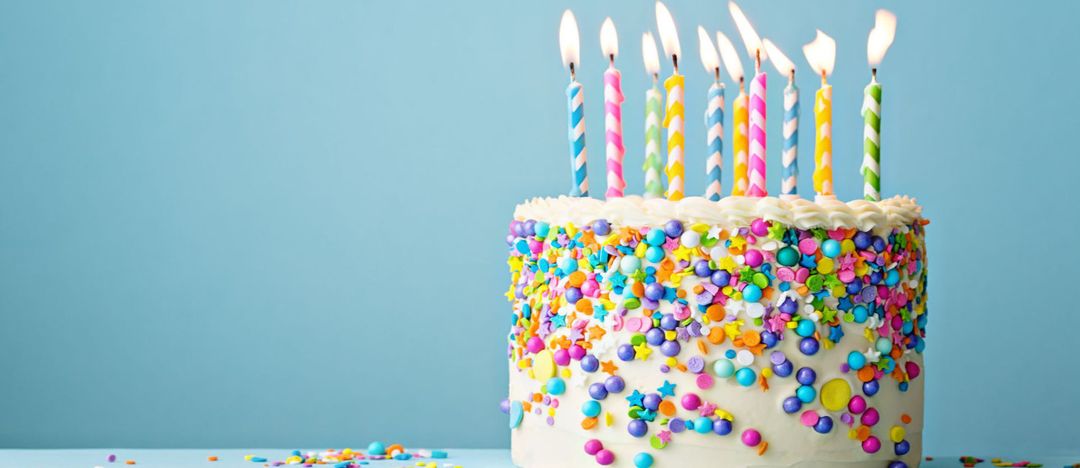
Locate an element on the screen. This screenshot has height=468, width=1080. candle is located at coordinates (580, 160), (615, 146), (653, 125), (675, 117), (715, 119), (742, 122), (756, 117), (791, 117), (827, 122), (872, 122).